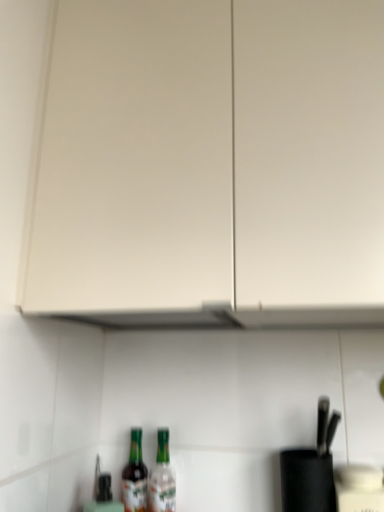
Question: From a real-world perspective, is green glass bottle at lower center, the 2th bottle in the right-to-left sequence, physically located above or below white matte cabinet at upper center?

Choices:
 (A) below
 (B) above

Answer: (A)

Question: From the image's perspective, is green glass bottle at lower center, the 2th bottle in the right-to-left sequence, positioned above or below white matte cabinet at upper center?

Choices:
 (A) above
 (B) below

Answer: (B)

Question: Estimate the real-world distances between objects in this image. Which object is closer to the translucent glass bottle at lower center, the first bottle in the right-to-left sequence?

Choices:
 (A) white matte cabinet at upper center
 (B) green glass bottle at lower center, the 2th bottle in the right-to-left sequence

Answer: (B)

Question: Estimate the real-world distances between objects in this image. Which object is farther from the white matte cabinet at upper center?

Choices:
 (A) green glass bottle at lower center, the 2th bottle in the right-to-left sequence
 (B) translucent glass bottle at lower center, the first bottle in the right-to-left sequence

Answer: (A)